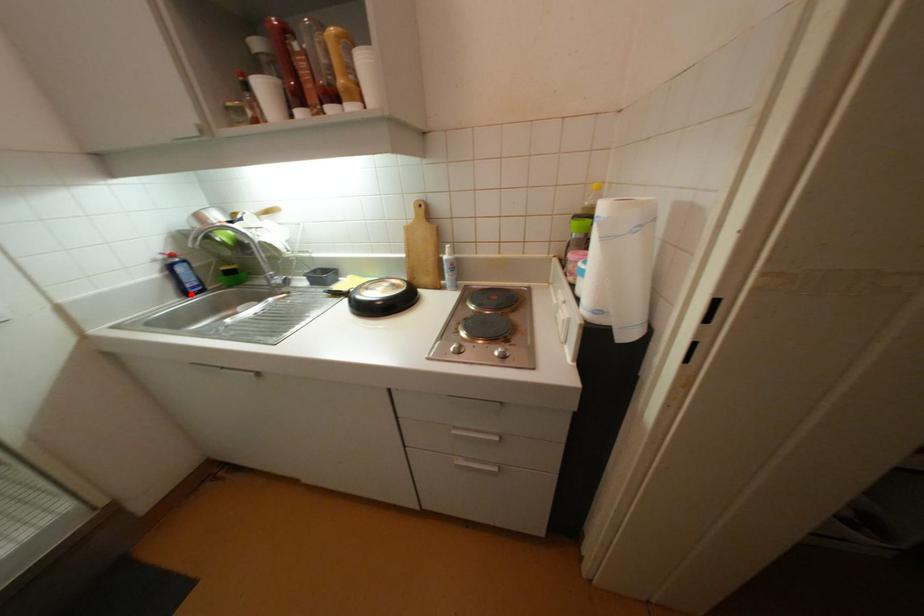
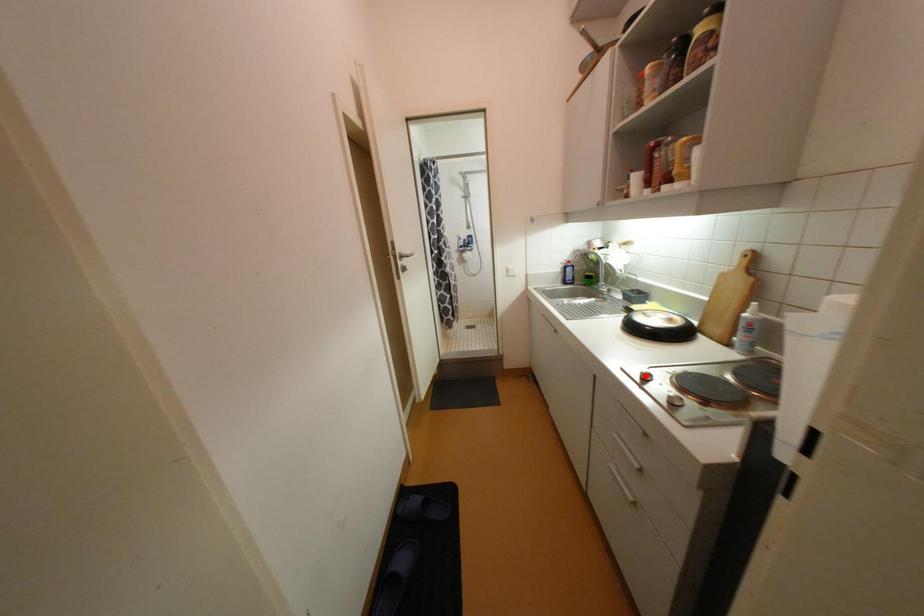
I am providing you with two images of the same scene from different viewpoints. A red point is marked on the first image and another point is marked on the second image. Is the red point in image1 aligned with the point shown in image2?

No